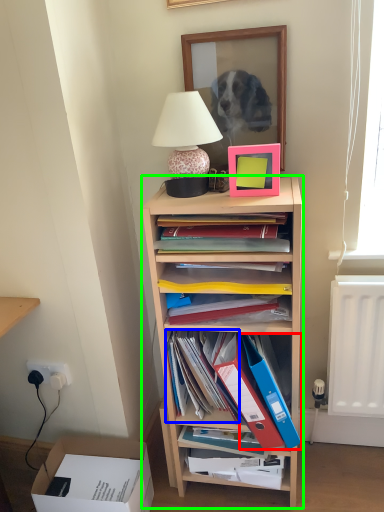
Question: Estimate the real-world distances between objects in this image. Which object is farther from paperback book (highlighted by a red box), book (highlighted by a blue box) or shelf (highlighted by a green box)?

Choices:
 (A) book
 (B) shelf

Answer: (B)